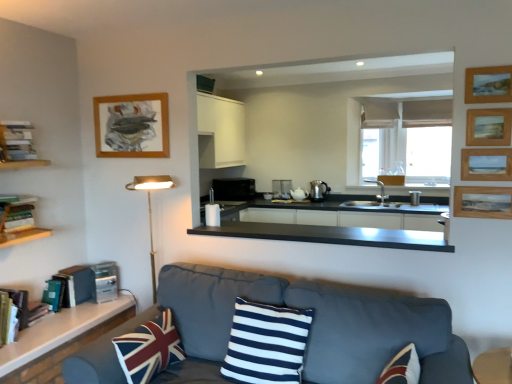
The height and width of the screenshot is (384, 512). What do you see at coordinates (267, 343) in the screenshot?
I see `navy blue and white striped cushion at center, the first pillow positioned from the right` at bounding box center [267, 343].

What do you see at coordinates (149, 348) in the screenshot?
I see `union jack fabric pillow at lower left, which ranks as the first pillow in left-to-right order` at bounding box center [149, 348].

In order to face wooden picture frame at upper right, the second picture frame in the front-to-back sequence, should I rotate leftwards or rightwards?

You should rotate right by 28.635 degrees.

Where is `metallic silver toaster at center, marked as the second appliance in a top-to-bottom arrangement`? The image size is (512, 384). metallic silver toaster at center, marked as the second appliance in a top-to-bottom arrangement is located at coordinates (415, 198).

Can you see wooden picture frame at upper right, the 4th picture frame positioned from the right, touching wooden bookshelf at left?

No, wooden picture frame at upper right, the 4th picture frame positioned from the right, is not next to wooden bookshelf at left.

Which object is closer to the camera, wooden picture frame at upper right, placed as the 1th picture frame when sorted from front to back, or wooden bookshelf at left?

Positioned in front is wooden picture frame at upper right, placed as the 1th picture frame when sorted from front to back.

Starting from the wooden bookshelf at left, which picture frame is the 4th one in front? Please provide its 2D coordinates.

[(488, 84)]

Can you tell me how much wooden picture frame at upper right, the 4th picture frame positioned from the right, and wooden bookshelf at left differ in facing direction?

wooden picture frame at upper right, the 4th picture frame positioned from the right, and wooden bookshelf at left are facing 88.3 degrees away from each other.

Is hardcover book at lower left, marked as the 1th book in a back-to-front arrangement, behind dark gray fabric couch at lower center?

Yes, hardcover book at lower left, marked as the 1th book in a back-to-front arrangement, is further from the camera.

Is hardcover book at lower left, marked as the third book in a front-to-back arrangement, oriented away from dark gray fabric couch at lower center?

No, hardcover book at lower left, marked as the third book in a front-to-back arrangement, is not facing the opposite direction of dark gray fabric couch at lower center.

From the image's perspective, which is below, hardcover book at lower left, marked as the 1th book in a back-to-front arrangement, or dark gray fabric couch at lower center?

dark gray fabric couch at lower center is shown below in the image.

The image size is (512, 384). Find the location of `book that is the 1st one when counting leftward from the dark gray fabric couch at lower center`. book that is the 1st one when counting leftward from the dark gray fabric couch at lower center is located at coordinates (75, 285).

Can you tell me how much satin silver toaster at lower left, which is the first appliance from bottom to top, and navy blue and white striped cushion at center, positioned as the second pillow in left-to-right order, differ in facing direction?

The angular difference between satin silver toaster at lower left, which is the first appliance from bottom to top, and navy blue and white striped cushion at center, positioned as the second pillow in left-to-right order, is 56.3 degrees.

From the image's perspective, who appears lower, satin silver toaster at lower left, which is the first appliance from bottom to top, or navy blue and white striped cushion at center, positioned as the second pillow in left-to-right order?

navy blue and white striped cushion at center, positioned as the second pillow in left-to-right order, is shown below in the image.

From the image's perspective, which appliance is the 1st one above the navy blue and white striped cushion at center, positioned as the second pillow in left-to-right order? Please provide its 2D coordinates.

[(105, 282)]

Would you say satin silver toaster at lower left, the 3th appliance viewed from the top, is to the left or to the right of navy blue and white striped cushion at center, positioned as the second pillow in left-to-right order, in the picture?

Based on their positions, satin silver toaster at lower left, the 3th appliance viewed from the top, is located to the left of navy blue and white striped cushion at center, positioned as the second pillow in left-to-right order.

From a real-world perspective, is navy blue and white striped cushion at center, positioned as the second pillow in left-to-right order, below satin silver toaster at lower left, which ranks as the first appliance in front-to-back order?

Actually, navy blue and white striped cushion at center, positioned as the second pillow in left-to-right order, is physically above satin silver toaster at lower left, which ranks as the first appliance in front-to-back order, in the real world.

Is navy blue and white striped cushion at center, the first pillow positioned from the right, placed right next to satin silver toaster at lower left, the 3th appliance in the back-to-front sequence?

navy blue and white striped cushion at center, the first pillow positioned from the right, and satin silver toaster at lower left, the 3th appliance in the back-to-front sequence, are clearly separated.

Can satin silver toaster at lower left, marked as the 1th appliance in a left-to-right arrangement, be found inside navy blue and white striped cushion at center, the first pillow positioned from the right?

No, satin silver toaster at lower left, marked as the 1th appliance in a left-to-right arrangement, is not a part of navy blue and white striped cushion at center, the first pillow positioned from the right.

Considering the positions of objects satin silver toaster at lower left, which is the first appliance from bottom to top, and wooden picture frame at upper right, the second picture frame in the front-to-back sequence, in the image provided, who is more to the right, satin silver toaster at lower left, which is the first appliance from bottom to top, or wooden picture frame at upper right, the second picture frame in the front-to-back sequence,?

From the viewer's perspective, wooden picture frame at upper right, the second picture frame in the front-to-back sequence, appears more on the right side.

Can you tell me how much satin silver toaster at lower left, marked as the 1th appliance in a left-to-right arrangement, and wooden picture frame at upper right, the second picture frame in the front-to-back sequence, differ in facing direction?

There is a 56.4-degree angle between the facing directions of satin silver toaster at lower left, marked as the 1th appliance in a left-to-right arrangement, and wooden picture frame at upper right, the second picture frame in the front-to-back sequence.

Considering the sizes of objects satin silver toaster at lower left, marked as the 1th appliance in a left-to-right arrangement, and wooden picture frame at upper right, which is counted as the third picture frame, starting from the right, in the image provided, who is thinner, satin silver toaster at lower left, marked as the 1th appliance in a left-to-right arrangement, or wooden picture frame at upper right, which is counted as the third picture frame, starting from the right,?

Thinner between the two is wooden picture frame at upper right, which is counted as the third picture frame, starting from the right.

From the image's perspective, between satin silver toaster at lower left, the 3th appliance viewed from the top, and wooden picture frame at upper right, positioned as the 4th picture frame in back-to-front order, who is located below?

satin silver toaster at lower left, the 3th appliance viewed from the top, from the image's perspective.

Who is more distant, wooden textured picture frame at right, the fourth picture frame positioned from the front, or white glossy countertop at lower left, arranged as the first countertop when ordered from the bottom?

Positioned behind is wooden textured picture frame at right, the fourth picture frame positioned from the front.

Does wooden textured picture frame at right, which ranks as the second picture frame in back-to-front order, turn towards white glossy countertop at lower left, the 2th countertop in the right-to-left sequence?

No, wooden textured picture frame at right, which ranks as the second picture frame in back-to-front order, is not aimed at white glossy countertop at lower left, the 2th countertop in the right-to-left sequence.

Which object is positioned more to the right, wooden textured picture frame at right, which ranks as the second picture frame in back-to-front order, or white glossy countertop at lower left, which appears as the 2th countertop when viewed from the top?

From the viewer's perspective, wooden textured picture frame at right, which ranks as the second picture frame in back-to-front order, appears more on the right side.

Which is behind, point (143, 356) or point (506, 123)?

The point (506, 123) is more distant.

Considering the positions of objects union jack fabric pillow at lower left, marked as the 2th pillow in a right-to-left arrangement, and wooden picture frame at upper right, which is counted as the third picture frame, starting from the right, in the image provided, who is more to the left, union jack fabric pillow at lower left, marked as the 2th pillow in a right-to-left arrangement, or wooden picture frame at upper right, which is counted as the third picture frame, starting from the right,?

From the viewer's perspective, union jack fabric pillow at lower left, marked as the 2th pillow in a right-to-left arrangement, appears more on the left side.

Is union jack fabric pillow at lower left, marked as the 2th pillow in a right-to-left arrangement, bigger than wooden picture frame at upper right, positioned as the 4th picture frame in back-to-front order?

Correct, union jack fabric pillow at lower left, marked as the 2th pillow in a right-to-left arrangement, is larger in size than wooden picture frame at upper right, positioned as the 4th picture frame in back-to-front order.

Does union jack fabric pillow at lower left, marked as the 2th pillow in a right-to-left arrangement, have a greater height compared to wooden picture frame at upper right, positioned as the 4th picture frame in back-to-front order?

Indeed, union jack fabric pillow at lower left, marked as the 2th pillow in a right-to-left arrangement, has a greater height compared to wooden picture frame at upper right, positioned as the 4th picture frame in back-to-front order.

Where is `shelf located below the wooden picture frame at upper right, the 5th picture frame positioned from the back (from the image's perspective)`? shelf located below the wooden picture frame at upper right, the 5th picture frame positioned from the back (from the image's perspective) is located at coordinates (18, 220).

At what (x,y) coordinates should I click in order to perform the action: click on studio couch on the right of hardcover book at lower left, positioned as the second book in bottom-to-top order. Please return your answer as a coordinate pair (x, y). Looking at the image, I should click on (315, 324).

Estimate the real-world distances between objects in this image. Which object is closer to hardcover books at left, acting as the third book starting from the back, dark gray fabric couch at lower center or satin silver kettle at center, which is the 1th appliance in back-to-front order?

Based on the image, dark gray fabric couch at lower center appears to be nearer to hardcover books at left, acting as the third book starting from the back.

Estimate the real-world distances between objects in this image. Which object is closer to hardcover books at left, which is counted as the 3th book, starting from the bottom, hardcover book at lower left, the first book ordered from the bottom, or wooden picture frame at upper right, positioned as the fourth picture frame in left-to-right order?

Based on the image, hardcover book at lower left, the first book ordered from the bottom, appears to be nearer to hardcover books at left, which is counted as the 3th book, starting from the bottom.

Based on their spatial positions, is white glossy countertop at lower left, arranged as the first countertop when ordered from the bottom, or black matte countertop at center, the 2th countertop positioned from the left, further from metallic silver toaster at center, positioned as the third appliance in left-to-right order?

white glossy countertop at lower left, arranged as the first countertop when ordered from the bottom, is further to metallic silver toaster at center, positioned as the third appliance in left-to-right order.

Looking at the image, which one is located closer to wooden picture frame at upper right, which is the 2th picture frame in left-to-right order, dark gray fabric couch at lower center or navy blue and white striped cushion at center, positioned as the second pillow in left-to-right order?

dark gray fabric couch at lower center.

Estimate the real-world distances between objects in this image. Which object is further from wooden textured picture frame at right, which ranks as the second picture frame in back-to-front order, satin silver kettle at center, the first appliance from the top, or gold metallic floor lamp at left?

Based on the image, satin silver kettle at center, the first appliance from the top, appears to be further to wooden textured picture frame at right, which ranks as the second picture frame in back-to-front order.

Looking at the image, which one is located closer to wooden textured picture frame at right, the fourth picture frame positioned from the front, union jack fabric pillow at lower left, which ranks as the first pillow in left-to-right order, or navy blue and white striped cushion at center, the first pillow positioned from the right?

The object closer to wooden textured picture frame at right, the fourth picture frame positioned from the front, is navy blue and white striped cushion at center, the first pillow positioned from the right.

From the image, which object appears to be farther from navy blue and white striped cushion at center, the first pillow positioned from the right, wooden picture frame at upper right, placed as the 1th picture frame when sorted from front to back, or white glossy countertop at lower left, the 2th countertop in the right-to-left sequence?

Among the two, wooden picture frame at upper right, placed as the 1th picture frame when sorted from front to back, is located further to navy blue and white striped cushion at center, the first pillow positioned from the right.

Considering their positions, is hardcover books at left, which is the first book from top to bottom, positioned further to union jack fabric pillow at lower left, which ranks as the first pillow in left-to-right order, than wooden picture frame at upper right, the second picture frame in the front-to-back sequence?

wooden picture frame at upper right, the second picture frame in the front-to-back sequence.

In order to click on light fixture between hardcover book at lower left, marked as the third book in a front-to-back arrangement, and wooden textured picture frame at right, placed as the 5th picture frame when sorted from left to right in this screenshot , I will do `click(151, 209)`.

Locate an element on the screen. Image resolution: width=512 pixels, height=384 pixels. studio couch between wooden bookshelf at left and navy blue and white striped cushion at center, positioned as the second pillow in left-to-right order is located at coordinates (315, 324).

Where is `studio couch between hardcover book at lower left, the second book when ordered from front to back, and wooden picture frame at upper right, marked as the 3th picture frame in a left-to-right arrangement, from left to right`? studio couch between hardcover book at lower left, the second book when ordered from front to back, and wooden picture frame at upper right, marked as the 3th picture frame in a left-to-right arrangement, from left to right is located at coordinates (315, 324).

Identify the location of studio couch between wooden bookshelf at left and wooden textured picture frame at right, the fourth picture frame positioned from the front. (315, 324).